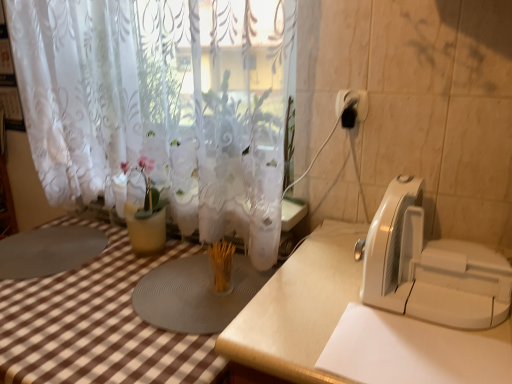
Question: Does white lace curtain at upper center have a smaller size compared to black plastic electric outlet at upper right?

Choices:
 (A) no
 (B) yes

Answer: (A)

Question: Does white lace curtain at upper center have a lesser height compared to black plastic electric outlet at upper right?

Choices:
 (A) no
 (B) yes

Answer: (A)

Question: From a real-world perspective, is white lace curtain at upper center on top of black plastic electric outlet at upper right?

Choices:
 (A) no
 (B) yes

Answer: (A)

Question: Can you confirm if white lace curtain at upper center is wider than black plastic electric outlet at upper right?

Choices:
 (A) yes
 (B) no

Answer: (A)

Question: Does white lace curtain at upper center touch black plastic electric outlet at upper right?

Choices:
 (A) yes
 (B) no

Answer: (B)

Question: Is point (385, 296) positioned closer to the camera than point (189, 16)?

Choices:
 (A) farther
 (B) closer

Answer: (B)

Question: Is white plastic appliance at right inside or outside of white lace curtain at upper center?

Choices:
 (A) outside
 (B) inside

Answer: (A)

Question: From a real-world perspective, is white plastic appliance at right above or below white lace curtain at upper center?

Choices:
 (A) below
 (B) above

Answer: (A)

Question: In terms of size, does white plastic appliance at right appear bigger or smaller than white lace curtain at upper center?

Choices:
 (A) big
 (B) small

Answer: (B)

Question: Is white lace curtain at upper center in front of or behind white plastic appliance at right in the image?

Choices:
 (A) behind
 (B) front

Answer: (A)

Question: From a real-world perspective, is white lace curtain at upper center positioned above or below white plastic appliance at right?

Choices:
 (A) below
 (B) above

Answer: (B)

Question: Looking at the image, does white lace curtain at upper center seem bigger or smaller compared to white plastic appliance at right?

Choices:
 (A) small
 (B) big

Answer: (B)

Question: From the image's perspective, is white lace curtain at upper center above or below white plastic appliance at right?

Choices:
 (A) below
 (B) above

Answer: (B)

Question: From the image's perspective, is white lace curtain at upper center above or below black plastic electric outlet at upper right?

Choices:
 (A) above
 (B) below

Answer: (A)

Question: From their relative heights in the image, would you say white lace curtain at upper center is taller or shorter than black plastic electric outlet at upper right?

Choices:
 (A) short
 (B) tall

Answer: (B)